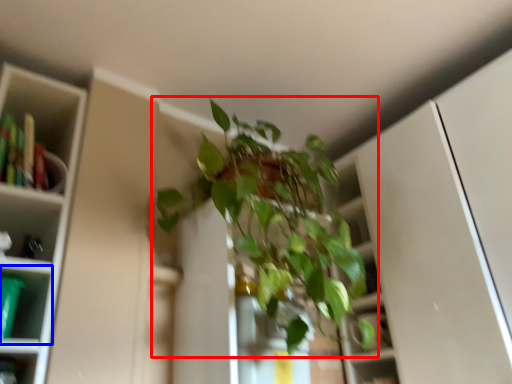
Question: Which point is closer to the camera, houseplant (highlighted by a red box) or shelf (highlighted by a blue box)?

Choices:
 (A) houseplant
 (B) shelf

Answer: (A)